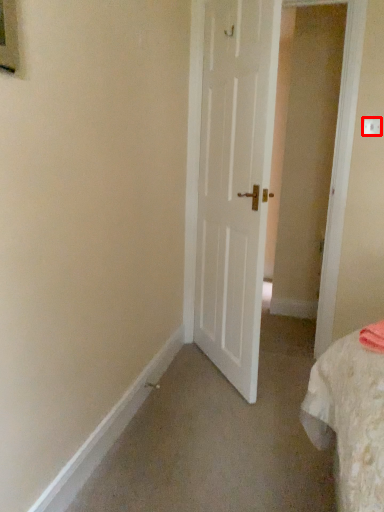
Question: Observing the image, what is the correct spatial positioning of electric outlet (annotated by the red box) in reference to door?

Choices:
 (A) left
 (B) right

Answer: (B)